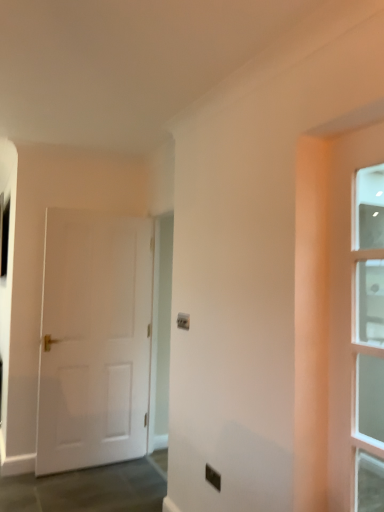
Question: Is white matte door at left, positioned as the 1th door in back-to-front order, inside the boundaries of black plastic electric outlet at center, or outside?

Choices:
 (A) inside
 (B) outside

Answer: (B)

Question: Is white matte door at left, acting as the second door starting from the front, taller or shorter than black plastic electric outlet at center?

Choices:
 (A) short
 (B) tall

Answer: (B)

Question: Estimate the real-world distances between objects in this image. Which object is closer to the clear glass door at right, the 2th door from the back?

Choices:
 (A) white matte door at left, acting as the second door starting from the front
 (B) black plastic electric outlet at center

Answer: (B)

Question: Estimate the real-world distances between objects in this image. Which object is closer to the clear glass door at right, the 1th door in the right-to-left sequence?

Choices:
 (A) white matte door at left, positioned as the 1th door in back-to-front order
 (B) black plastic electric outlet at center

Answer: (B)